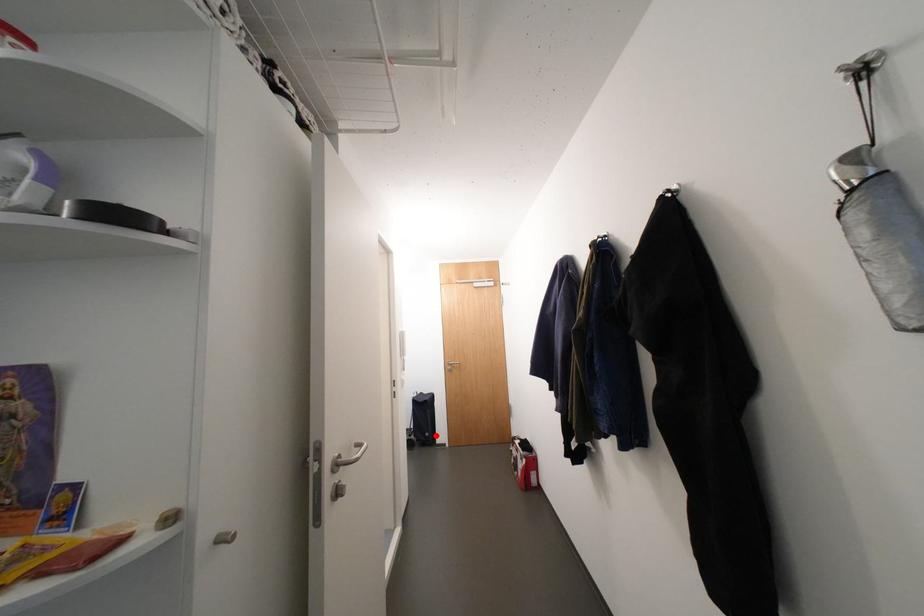
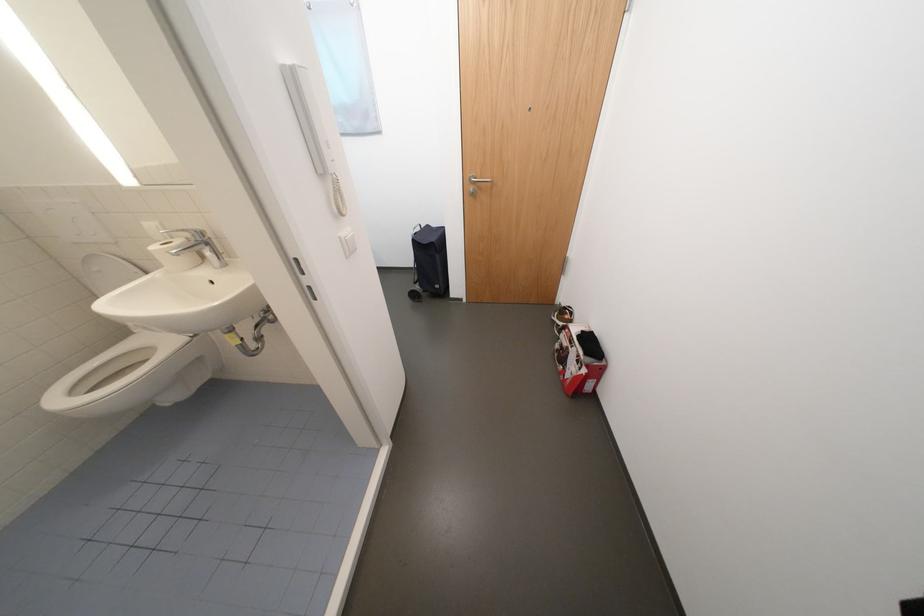
In the second image, find the point that corresponds to the highlighted location in the first image.

(445, 286)